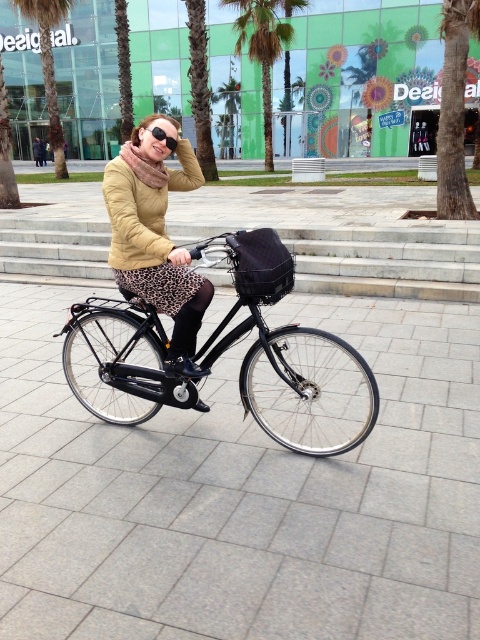
Can you confirm if green leafy palm tree at upper left is positioned to the right of black matte goggles at upper center?

Incorrect, green leafy palm tree at upper left is not on the right side of black matte goggles at upper center.

Between point (36, 13) and point (166, 145), which one is positioned in front?

Point (166, 145) is more forward.

Find the location of a particular element. This screenshot has height=640, width=480. green leafy palm tree at upper left is located at coordinates (48, 67).

Who is more forward, (162,252) or (43,12)?

Point (162,252) is more forward.

From the picture: Is matte black jacket at center above green leafy palm tree at upper left?

No, matte black jacket at center is not above green leafy palm tree at upper left.

Is point (177, 250) less distant than point (56, 106)?

Yes, point (177, 250) is in front of point (56, 106).

Locate an element on the screen. Image resolution: width=480 pixels, height=640 pixels. matte black jacket at center is located at coordinates (156, 236).

Which is more to the right, matte black jacket at center or green leafy palm tree at center?

green leafy palm tree at center

Is point (175, 324) positioned after point (301, 8)?

No.

Find the location of `matte black jacket at center`. matte black jacket at center is located at coordinates (156, 236).